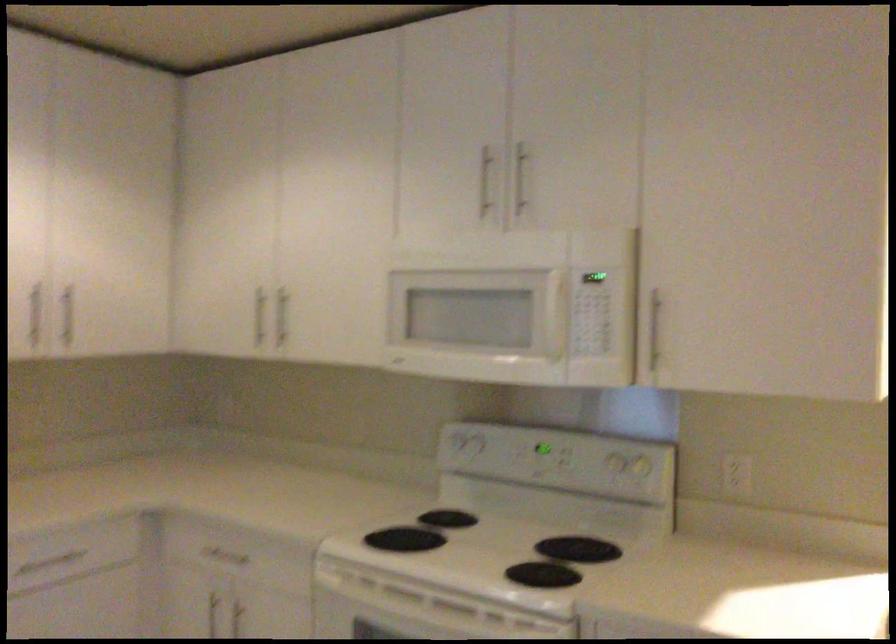
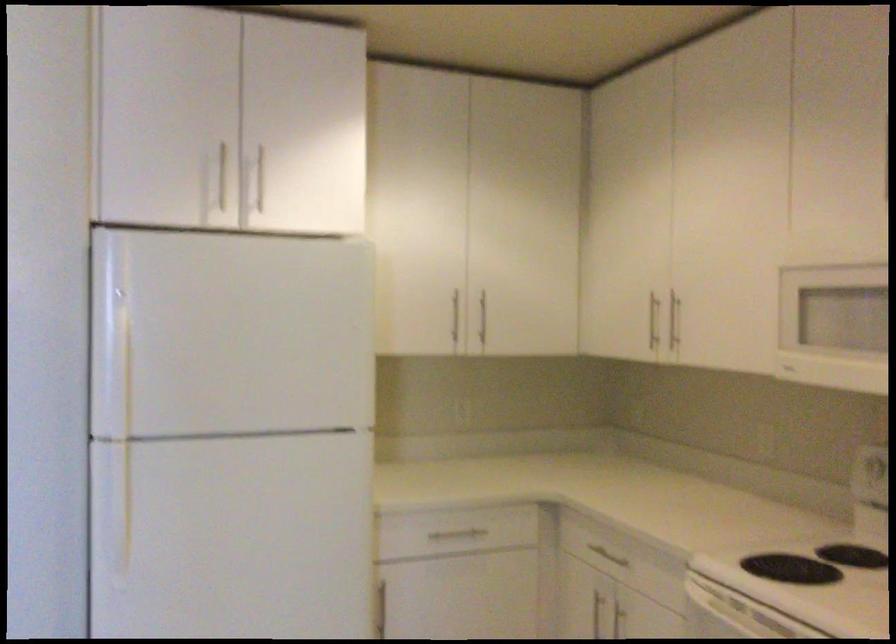
Question: The camera is either moving clockwise (left) or counter-clockwise (right) around the object. The first image is from the beginning of the video and the second image is from the end. Is the camera moving left or right when shooting the video?

Choices:
 (A) Left
 (B) Right

Answer: (B)